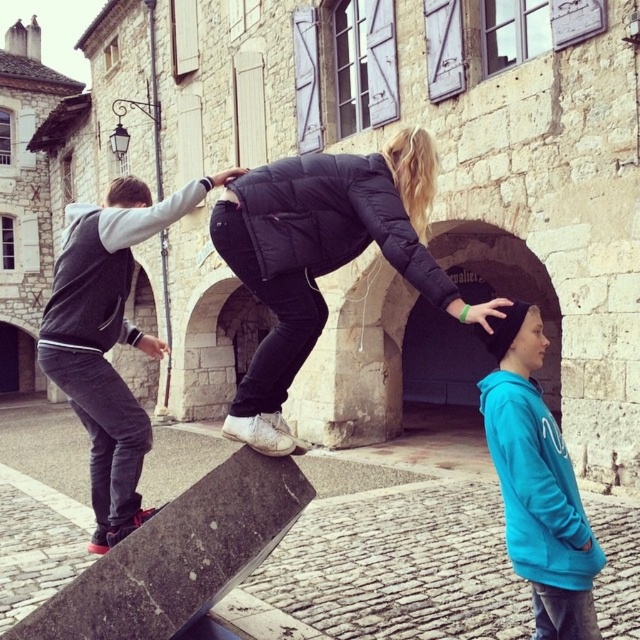
You are a photographer trying to capture the scene of the black puffer jacket at center and the turquoise hoodie at right. Which one should you zoom in on to ensure they both fit in the frame without cropping?

The black puffer jacket at center is bigger than the turquoise hoodie at right, so you should zoom in on the smaller one, the turquoise hoodie at right, to include both in the frame without cropping.

You are a photographer trying to capture a candid shot of the black puffer jacket at center and the turquoise hoodie at right. To ensure both subjects are in focus, you need to know which one is closer to you. Can you determine which subject is nearer to your camera position?

The black puffer jacket at center is closer to you than the turquoise hoodie at right, so you should focus on the black puffer jacket at center to ensure both are in focus.

You are standing at the camera position and want to know how far the point at coordinates (76, 314) is from you. Can you determine the distance?

The point at coordinates (76, 314) is 22.37 meters away from the camera.